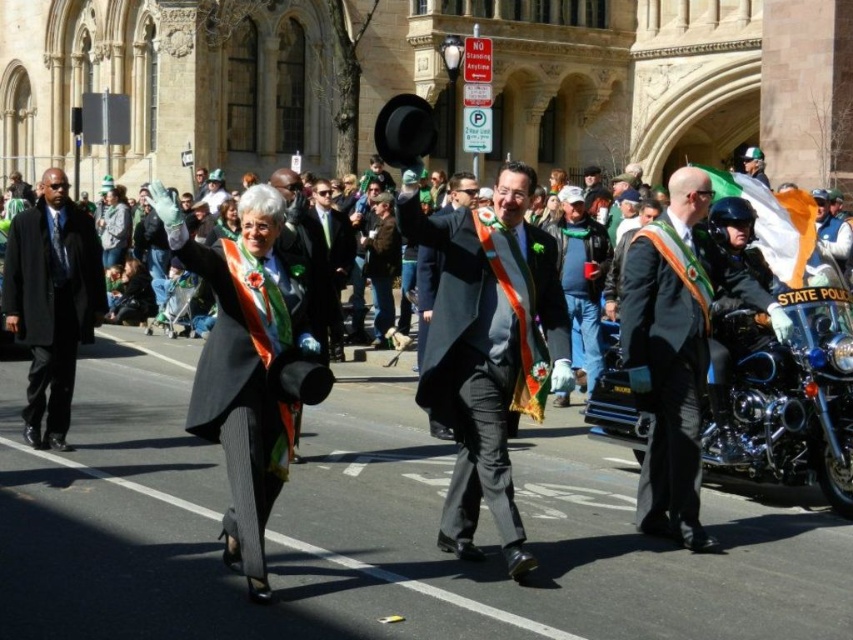
Question: Is the position of matte black suit at left less distant than that of shiny black suit at center?

Choices:
 (A) no
 (B) yes

Answer: (A)

Question: Which of the following is the closest to the observer?

Choices:
 (A) (28, 340)
 (B) (677, 300)
 (C) (531, 262)

Answer: (C)

Question: Is the position of matte black suit at center more distant than that of shiny black suit at center?

Choices:
 (A) yes
 (B) no

Answer: (B)

Question: Which of the following is the closest to the observer?

Choices:
 (A) blue denim jeans at center
 (B) chrome polished motorcycle at right
 (C) matte black suit at left

Answer: (A)

Question: Which object is closer to the camera taking this photo?

Choices:
 (A) matte black suit at center
 (B) shiny black coat at center
 (C) matte black suit at left
 (D) gray wool business suit at right

Answer: (A)

Question: Is shiny black coat at center to the right of chrome polished motorcycle at right from the viewer's perspective?

Choices:
 (A) yes
 (B) no

Answer: (B)